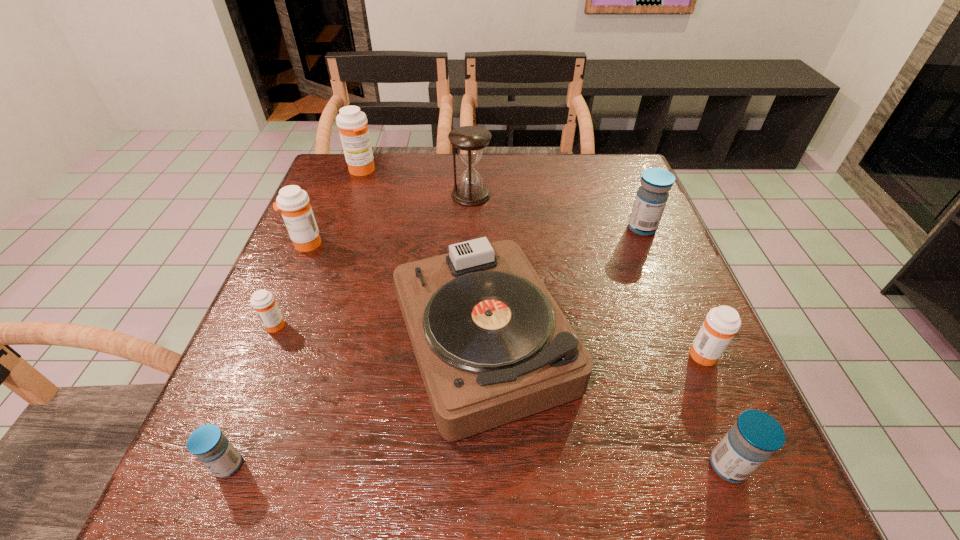
This screenshot has height=540, width=960. In order to click on vacant region between the eighth nearest object and the leftmost blue medicine in this screenshot , I will do `click(349, 330)`.

The image size is (960, 540). I want to click on free space that is in between the biggest blue medicine and the tallest medicine, so click(502, 199).

Select which object is the eighth closest to the biggest blue medicine. Please provide its 2D coordinates. Your answer should be formatted as a tuple, i.e. [(x, y)], where the tuple contains the x and y coordinates of a point satisfying the conditions above.

[(207, 443)]

The image size is (960, 540). What are the coordinates of `object that ranks as the sixth closest to the record player` in the screenshot? It's located at (263, 302).

I want to click on the third closest medicine to the second biggest blue medicine, so point(207,443).

Image resolution: width=960 pixels, height=540 pixels. What are the coordinates of `medicine object that ranks as the fifth closest to the second smallest blue medicine` in the screenshot? It's located at (293, 202).

At what (x,y) coordinates should I click in order to perform the action: click on the closest orange medicine to the third smallest orange medicine. Please return your answer as a coordinate pair (x, y). Image resolution: width=960 pixels, height=540 pixels. Looking at the image, I should click on (263, 302).

Identify the location of orange medicine identified as the closest to the second farthest orange medicine. (263, 302).

Locate which blue medicine ranks third in proximity to the record player. Please provide its 2D coordinates. Your answer should be formatted as a tuple, i.e. [(x, y)], where the tuple contains the x and y coordinates of a point satisfying the conditions above.

[(651, 198)]

Point out which blue medicine is positioned as the third nearest to the hourglass. Please provide its 2D coordinates. Your answer should be formatted as a tuple, i.e. [(x, y)], where the tuple contains the x and y coordinates of a point satisfying the conditions above.

[(756, 435)]